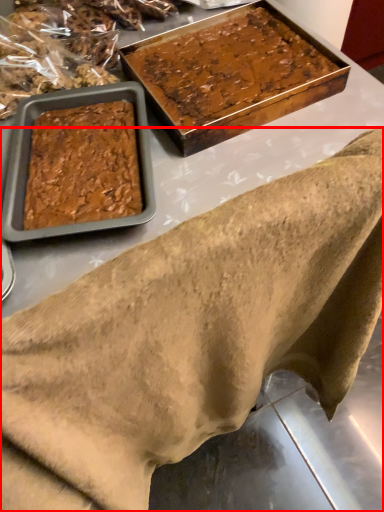
Question: From the image's perspective, where is wrap (annotated by the red box) located relative to dessert?

Choices:
 (A) above
 (B) below

Answer: (B)